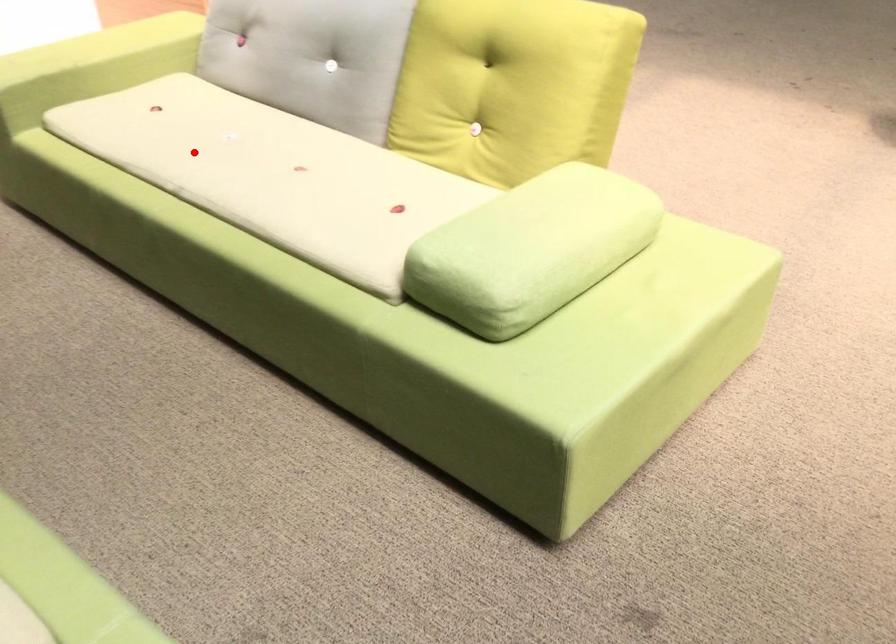
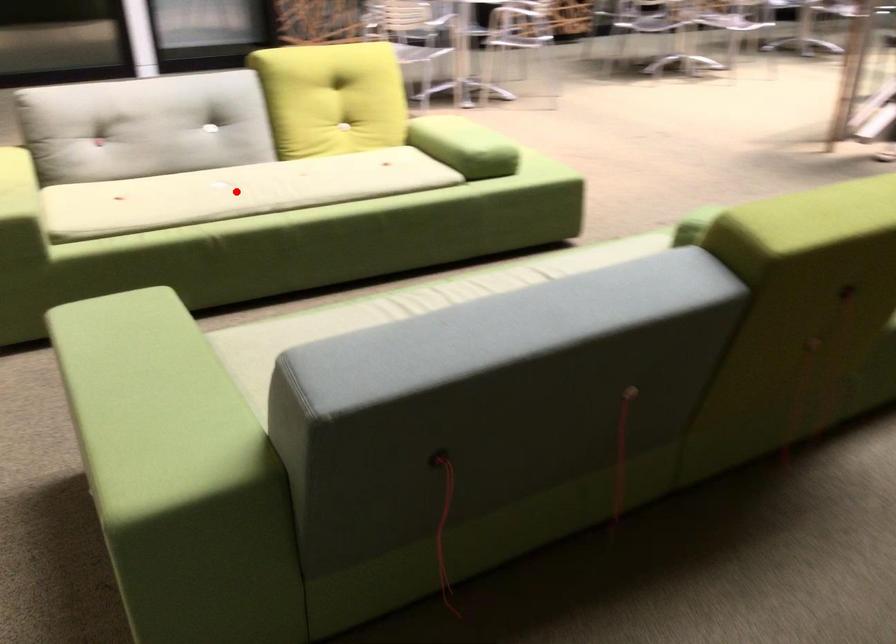
I am providing you with two images of the same scene from different viewpoints. A red point is marked on the first image and another point is marked on the second image. Do the highlighted points in image1 and image2 indicate the same real-world spot?

Yes